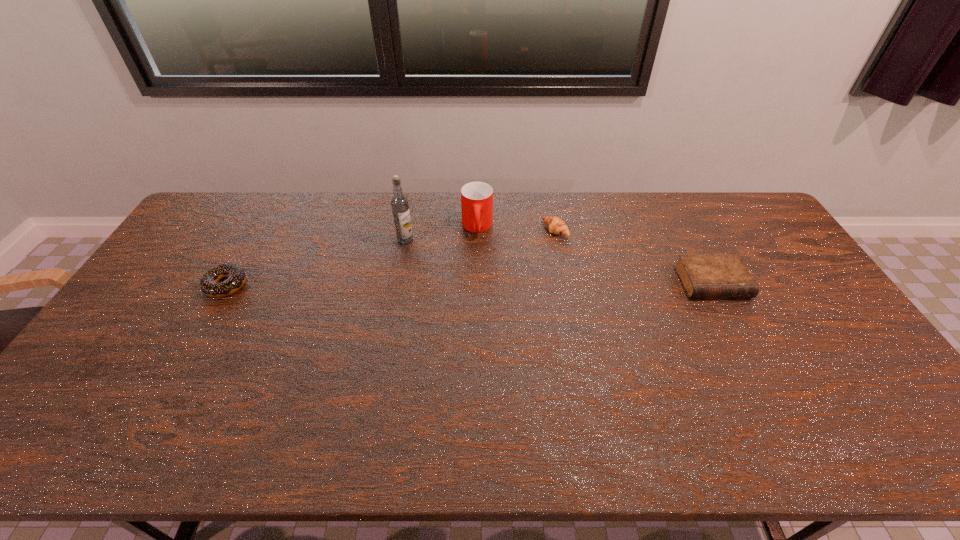
Identify the location of blank region between the doughnut and the diary. The image size is (960, 540). (469, 284).

What are the coordinates of `vacant area between the tallest object and the leftmost object` in the screenshot? It's located at (316, 263).

Locate an element on the screen. free spot between the doughnut and the third object from left to right is located at coordinates (351, 256).

Find the location of a particular element. This screenshot has height=540, width=960. free spot between the diary and the pastry is located at coordinates (634, 256).

Where is `object that is the second closest to the tallest object`? object that is the second closest to the tallest object is located at coordinates 555,225.

The image size is (960, 540). What are the coordinates of `object that is the fourth nearest to the second object from left to right` in the screenshot? It's located at (702, 275).

I want to click on free point that satisfies the following two spatial constraints: 1. on the back side of the leftmost object; 2. on the right side of the second object from right to left, so click(257, 231).

I want to click on free region that satisfies the following two spatial constraints: 1. on the back side of the second object from right to left; 2. on the left side of the doughnut, so click(x=257, y=231).

Where is `free space that satisfies the following two spatial constraints: 1. on the back side of the vodka; 2. on the left side of the third object from right to left`? free space that satisfies the following two spatial constraints: 1. on the back side of the vodka; 2. on the left side of the third object from right to left is located at coordinates (408, 227).